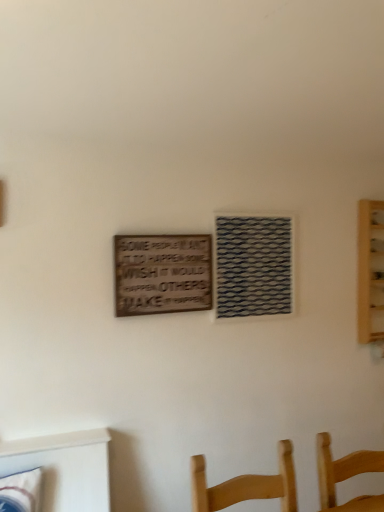
Question: Does wooden sign at center lie behind woven fabric window at center?

Choices:
 (A) no
 (B) yes

Answer: (A)

Question: From the image's perspective, would you say wooden sign at center is positioned over woven fabric window at center?

Choices:
 (A) no
 (B) yes

Answer: (A)

Question: Is wooden sign at center wider than woven fabric window at center?

Choices:
 (A) yes
 (B) no

Answer: (B)

Question: Can you confirm if wooden sign at center is positioned to the left of woven fabric window at center?

Choices:
 (A) no
 (B) yes

Answer: (B)

Question: Is wooden sign at center positioned before woven fabric window at center?

Choices:
 (A) no
 (B) yes

Answer: (B)

Question: Can you confirm if wooden sign at center is taller than woven fabric window at center?

Choices:
 (A) no
 (B) yes

Answer: (A)

Question: Is wooden sign at center completely or partially inside woven fabric window at center?

Choices:
 (A) yes
 (B) no

Answer: (B)

Question: Can you confirm if woven fabric window at center is smaller than wooden sign at center?

Choices:
 (A) no
 (B) yes

Answer: (A)

Question: From the image's perspective, is woven fabric window at center above wooden sign at center?

Choices:
 (A) yes
 (B) no

Answer: (A)

Question: Would you consider woven fabric window at center to be distant from wooden sign at center?

Choices:
 (A) no
 (B) yes

Answer: (A)

Question: From a real-world perspective, is woven fabric window at center beneath wooden sign at center?

Choices:
 (A) yes
 (B) no

Answer: (B)

Question: From the image's perspective, does woven fabric window at center appear lower than wooden sign at center?

Choices:
 (A) yes
 (B) no

Answer: (B)

Question: Is point (263, 296) positioned closer to the camera than point (168, 249)?

Choices:
 (A) closer
 (B) farther

Answer: (B)